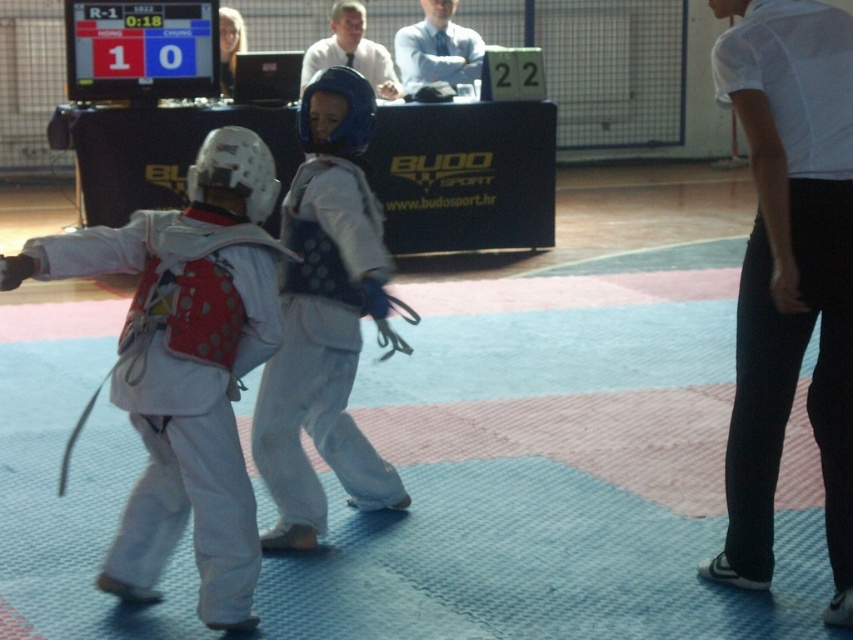
Question: Which point is closer to the camera taking this photo?

Choices:
 (A) (363, 74)
 (B) (173, 372)

Answer: (B)

Question: Which object is positioned farthest from the white matte karate uniform at left?

Choices:
 (A) white matte karate uniform at center
 (B) blonde hair at upper center
 (C) white shirt at upper center
 (D) white smooth shirt at upper right

Answer: (B)

Question: Is white matte karate uniform at left in front of white matte karate uniform at center?

Choices:
 (A) yes
 (B) no

Answer: (A)

Question: Among these points, which one is nearest to the camera?

Choices:
 (A) (224, 342)
 (B) (231, 90)

Answer: (A)

Question: Does white matte karate uniform at center appear on the left side of white shirt at upper center?

Choices:
 (A) yes
 (B) no

Answer: (B)

Question: Is white smooth shirt at upper right wider than white matte karate uniform at center?

Choices:
 (A) no
 (B) yes

Answer: (A)